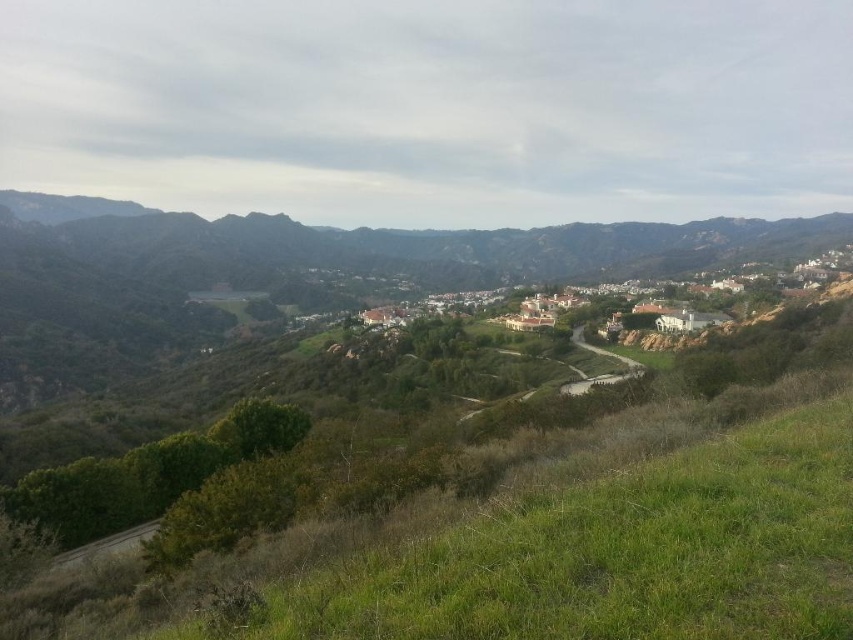
You are standing at the point labeled as point (x=405, y=243) in the image. Looking around, you notice a winding road in the middle ground. Which direction should you walk to reach the winding road from your current position?

The winding road is in the middle ground, so you should walk towards the middle ground from the point labeled point (x=405, y=243) to reach it.

You are a drone operator planning to fly a drone from the green grassy hillside at center to the white stucco houses at center. Based on the scene, which direction should you fly the drone to reach the houses?

The green grassy hillside at center is positioned on the left side of white stucco houses at center, so the drone should be flown to the right to reach the houses.